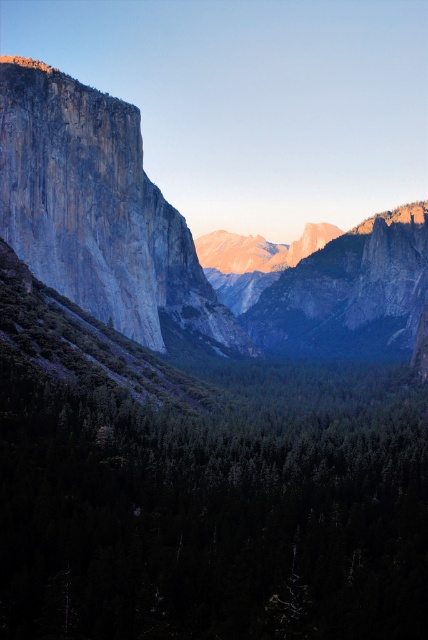
What do you see at coordinates (216, 509) in the screenshot?
I see `green matte forest at center` at bounding box center [216, 509].

Measure the distance between green matte forest at center and granite cliff face at left.

green matte forest at center and granite cliff face at left are 89.13 meters apart from each other.

Does point (77, 428) come closer to viewer compared to point (53, 108)?

That is True.

The height and width of the screenshot is (640, 428). In order to click on green matte forest at center in this screenshot , I will do `click(216, 509)`.